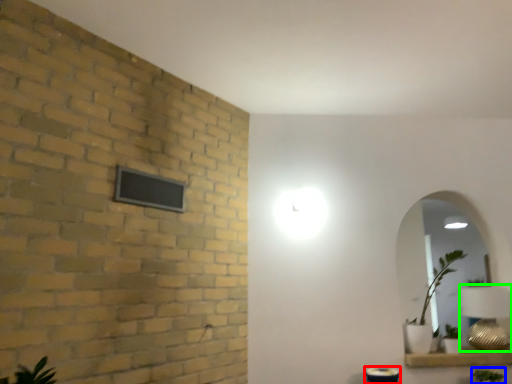
Question: Estimate the real-world distances between objects in this image. Which object is farther from table (highlighted by a red box), plant (highlighted by a blue box) or table lamp (highlighted by a green box)?

Choices:
 (A) plant
 (B) table lamp

Answer: (B)